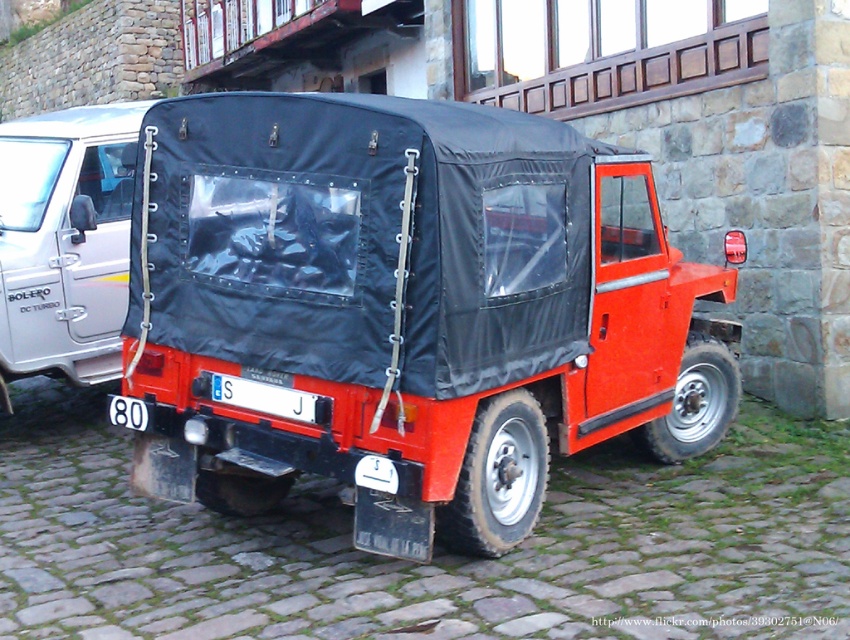
Question: Does matte black car at right appear on the left side of white plastic license plate at center?

Choices:
 (A) yes
 (B) no

Answer: (A)

Question: Is matte black truck at center thinner than white plastic license plate at center?

Choices:
 (A) no
 (B) yes

Answer: (A)

Question: Which object is the closest to the matte black truck at center?

Choices:
 (A) white plastic license plate at center
 (B) matte black car at right

Answer: (A)

Question: Where is matte black car at right located in relation to white plastic license plate at center in the image?

Choices:
 (A) left
 (B) right

Answer: (A)

Question: Which of the following is the closest to the observer?

Choices:
 (A) matte black truck at center
 (B) white plastic license plate at center

Answer: (A)

Question: Among these objects, which one is nearest to the camera?

Choices:
 (A) matte black truck at center
 (B) white plastic license plate at center
 (C) matte black car at right

Answer: (A)